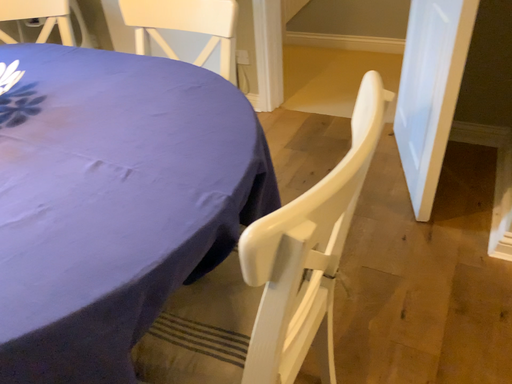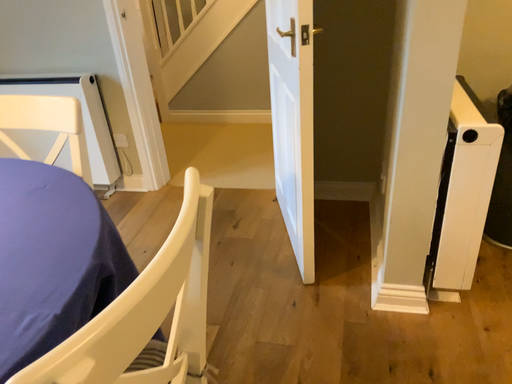
Question: How did the camera likely rotate when shooting the video?

Choices:
 (A) rotated right
 (B) rotated left

Answer: (A)